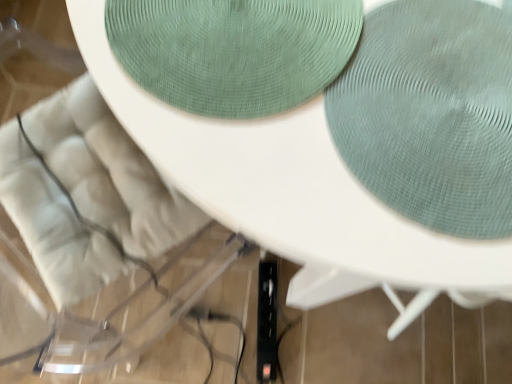
Locate an element on the screen. The height and width of the screenshot is (384, 512). free location above green textured placemat at upper center (from a real-world perspective) is located at coordinates (246, 44).